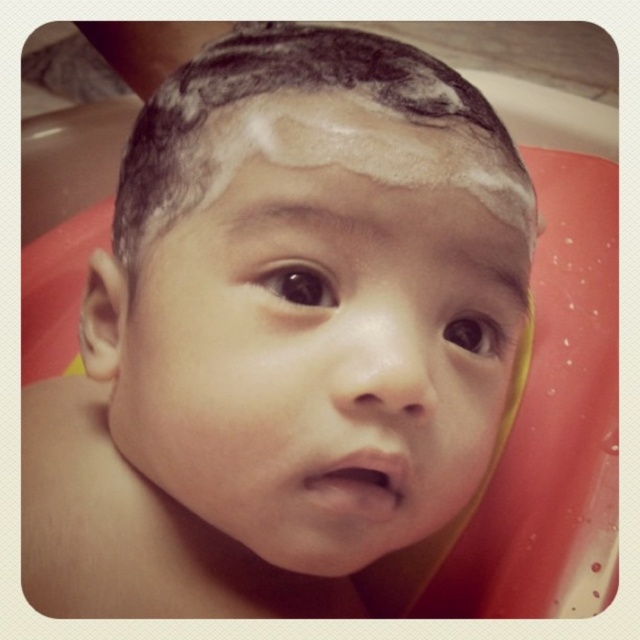
Based on the photo, you are a photographer adjusting your camera to focus on two points in the image. The first point is at coordinates point (x=307, y=440) and the second is at point (x=387, y=86). Since you can only focus on one point at a time, which point should you choose to ensure the other point remains in acceptable focus range? Please explain your reasoning based on their positions.

You should focus on point (x=307, y=440) because it is closer to the viewer than point (x=387, y=86). By focusing on the closer point, the depth of field may extend backward, potentially keeping the farther point within an acceptable focus range.

You are a photographer taking a close up shot of a baby during bath time. You need to focus on the smooth skin baby at center and the wet dark brown hair at center. Which one should you focus on first to ensure the subject is sharp?

The smooth skin baby at center is in front of the wet dark brown hair at center, so you should focus on the smooth skin baby at center first to ensure the subject is sharp.

You are holding a small toy that is 3 inches in diameter. You want to place it on the point at coordinates point (422, 241). Can the toy fit on that point without overlapping?

The point at coordinates point (422, 241) is 12.77 inches away from the viewer. Since the toy is only 3 inches in diameter, there is enough space for it to fit without overlapping.